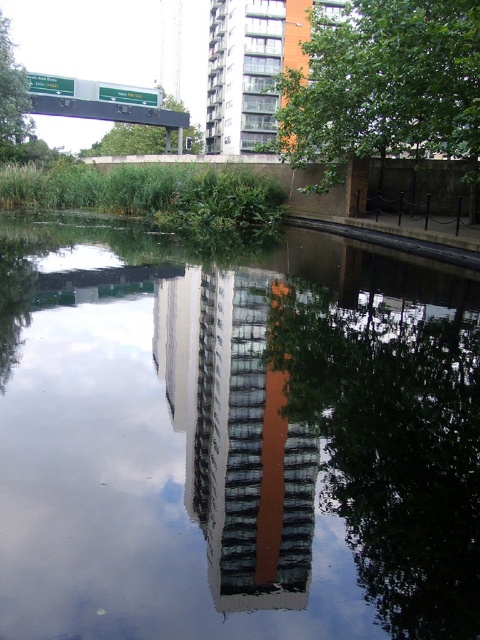
You are standing at the point labeled point [205,289] and want to take a photo of the point labeled point [8,90]. Given that the camera can only focus on objects within 1 meter, will you be able to capture both points in focus?

Since point [205,289] is closer to the camera than point [8,90], the distance between them might exceed the camera focus range. However, without knowing the exact distance between the points, it is impossible to determine if both can be in focus.

You are standing at point [237,436] in the image. What object is directly beneath your feet?

The reflective glass building at center is directly beneath the point [237,436].

You are standing at the edge of the water in the urban scene. You see a point marked at coordinates [385,86]. What object does this point correspond to?

The point at coordinates [385,86] corresponds to the green leafy tree at center.